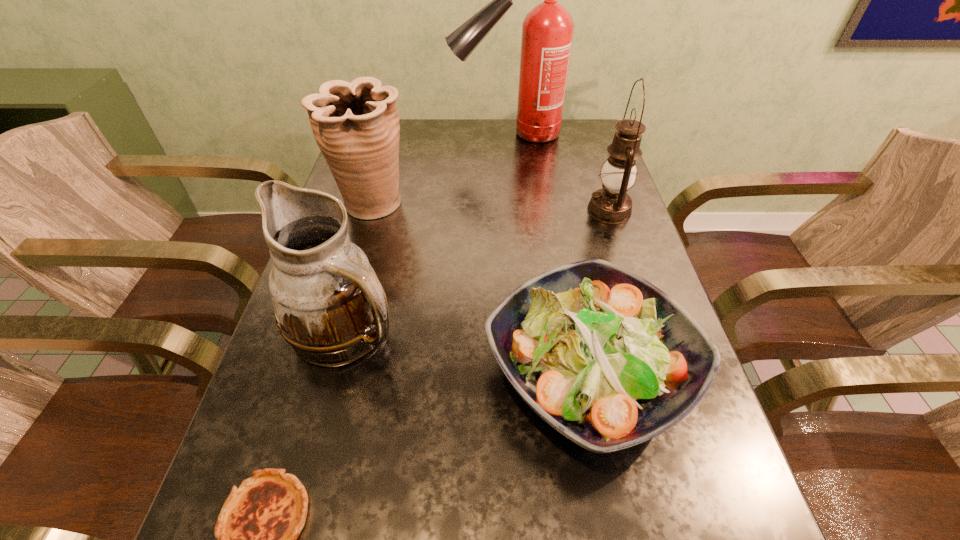
Identify the location of free spot located from the spout of the pitcher. The width and height of the screenshot is (960, 540). (456, 330).

You are a GUI agent. You are given a task and a screenshot of the screen. Output one action in this format:
    pyautogui.click(x=<x>, y=<y>)
    Task: Click on the blank area located 0.210m on the front of the urn
    
    Given the screenshot: What is the action you would take?
    pyautogui.click(x=348, y=292)

At what (x,y) coordinates should I click in order to perform the action: click on vacant space positioned on the back of the salad plate. Please return your answer as a coordinate pair (x, y). Image resolution: width=960 pixels, height=540 pixels. Looking at the image, I should click on (569, 275).

The image size is (960, 540). Identify the location of object positioned at the far edge. (547, 31).

I want to click on pitcher present at the left edge, so click(329, 305).

This screenshot has height=540, width=960. Identify the location of urn located in the left edge section of the desktop. (356, 125).

Where is `fire extinguisher that is at the right edge`? The width and height of the screenshot is (960, 540). fire extinguisher that is at the right edge is located at coordinates (547, 31).

This screenshot has width=960, height=540. What are the coordinates of `oil lamp that is positioned at the right edge` in the screenshot? It's located at (611, 204).

Locate an element on the screen. The image size is (960, 540). salad plate situated at the right edge is located at coordinates (606, 358).

You are a GUI agent. You are given a task and a screenshot of the screen. Output one action in this format:
    pyautogui.click(x=<x>, y=<y>)
    Task: Click on the object positioned at the far right corner
    This screenshot has width=960, height=540.
    Given the screenshot: What is the action you would take?
    pyautogui.click(x=547, y=31)